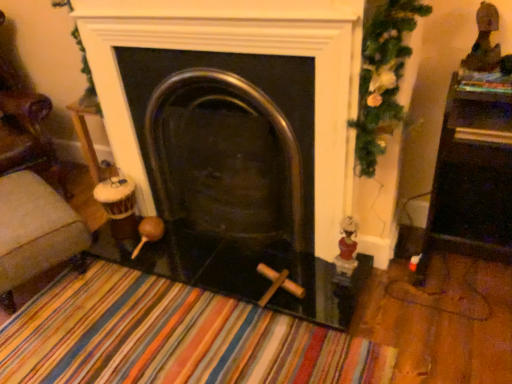
Question: Could polished metal fireplace at center be considered to be inside green textured garland at upper right?

Choices:
 (A) yes
 (B) no

Answer: (B)

Question: Is green textured garland at upper right beside polished metal fireplace at center?

Choices:
 (A) no
 (B) yes

Answer: (A)

Question: Does green textured garland at upper right have a lesser height compared to polished metal fireplace at center?

Choices:
 (A) no
 (B) yes

Answer: (B)

Question: Does green textured garland at upper right appear on the right side of polished metal fireplace at center?

Choices:
 (A) no
 (B) yes

Answer: (B)

Question: Is green textured garland at upper right not close to polished metal fireplace at center?

Choices:
 (A) yes
 (B) no

Answer: (B)

Question: Considering the relative sizes of green textured garland at upper right and polished metal fireplace at center in the image provided, is green textured garland at upper right wider than polished metal fireplace at center?

Choices:
 (A) yes
 (B) no

Answer: (B)

Question: Could you tell me if white porcelain figurine at right, the second toy from the right, is turned towards green textured garland at upper right?

Choices:
 (A) no
 (B) yes

Answer: (A)

Question: Is white porcelain figurine at right, the first toy in the left-to-right sequence, thinner than green textured garland at upper right?

Choices:
 (A) yes
 (B) no

Answer: (A)

Question: From a real-world perspective, is white porcelain figurine at right, acting as the first toy starting from the bottom, located higher than green textured garland at upper right?

Choices:
 (A) yes
 (B) no

Answer: (B)

Question: Is white porcelain figurine at right, which appears as the second toy when viewed from the top, further to the viewer compared to green textured garland at upper right?

Choices:
 (A) yes
 (B) no

Answer: (A)

Question: From the image's perspective, is white porcelain figurine at right, the second toy from the right, over green textured garland at upper right?

Choices:
 (A) yes
 (B) no

Answer: (B)

Question: Is green textured garland at upper right completely or partially inside white porcelain figurine at right, which appears as the second toy when viewed from the top?

Choices:
 (A) yes
 (B) no

Answer: (B)

Question: Is polished metal fireplace at center positioned before shiny dark brown statue at upper right, which is the 2th toy from left to right?

Choices:
 (A) yes
 (B) no

Answer: (B)